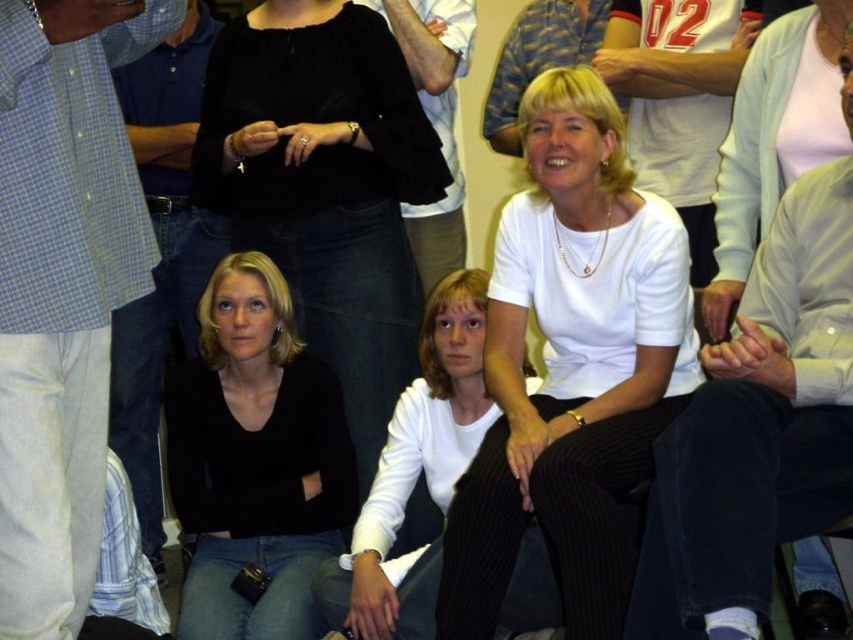
Question: Which point is farther to the camera?

Choices:
 (A) black matte shirt at center
 (B) light pink fabric at upper right

Answer: (A)

Question: Can you confirm if light blue checkered shirt at left is thinner than black matte shirt at center?

Choices:
 (A) no
 (B) yes

Answer: (B)

Question: Which point is farther to the camera?

Choices:
 (A) (212, 380)
 (B) (107, 132)
 (C) (305, 109)
 (D) (500, 291)

Answer: (A)

Question: Does white matte shirt at center have a greater width compared to black matte shirt at lower left?

Choices:
 (A) yes
 (B) no

Answer: (A)

Question: Does black matte shirt at center have a greater width compared to black matte shirt at lower left?

Choices:
 (A) yes
 (B) no

Answer: (A)

Question: Which is farther from the black matte shirt at center?

Choices:
 (A) light blue checkered shirt at left
 (B) white matte shirt at center
 (C) black matte shirt at lower left
 (D) light pink fabric at upper right

Answer: (D)